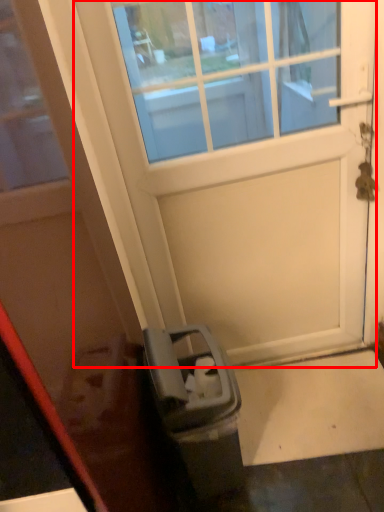
Question: From the image's perspective, where is door (annotated by the red box) located relative to door?

Choices:
 (A) above
 (B) below

Answer: (A)